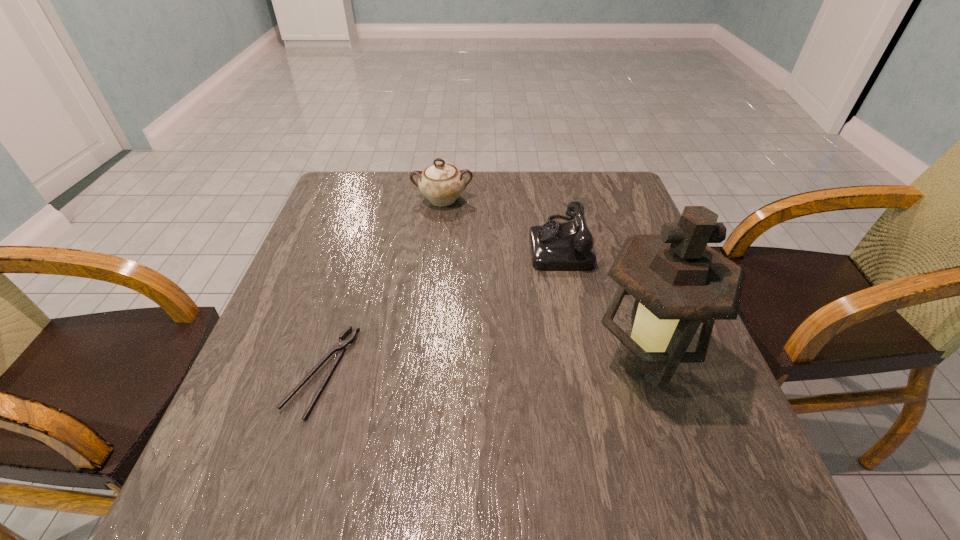
Where is `free point located on the dial of the second shortest object`? free point located on the dial of the second shortest object is located at coordinates (476, 244).

Locate an element on the screen. This screenshot has width=960, height=540. free space located on the dial of the second shortest object is located at coordinates (377, 244).

At what (x,y) coordinates should I click in order to perform the action: click on vacant space located on the back of the leftmost object. Please return your answer as a coordinate pair (x, y). Looking at the image, I should click on [355, 265].

I want to click on object that is at the far edge, so click(442, 183).

Locate an element on the screen. object at the left edge is located at coordinates (x=340, y=346).

Image resolution: width=960 pixels, height=540 pixels. I want to click on object located at the right edge, so click(678, 281).

This screenshot has height=540, width=960. I want to click on vacant space at the far edge of the desktop, so click(492, 213).

In the image, there is a desktop. Where is `vacant space at the near edge`? This screenshot has width=960, height=540. vacant space at the near edge is located at coordinates (427, 478).

Find the location of `vacant region at the left edge of the desktop`. vacant region at the left edge of the desktop is located at coordinates (254, 363).

I want to click on vacant space at the right edge of the desktop, so click(629, 221).